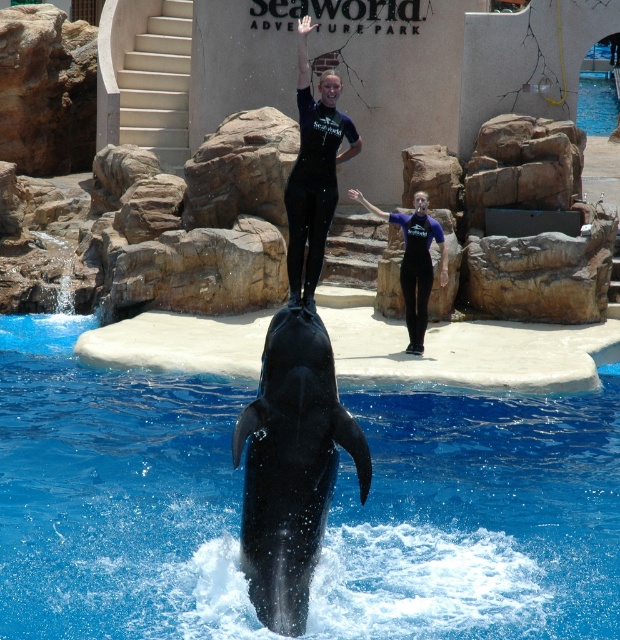
Based on the photo, who is taller, black smooth whale at center or black matte wetsuit at center?

black matte wetsuit at center

Does point (259, 413) lie in front of point (290, 294)?

Yes, point (259, 413) is closer to viewer.

This screenshot has width=620, height=640. In order to click on black smooth whale at center in this screenshot , I will do `click(291, 465)`.

The width and height of the screenshot is (620, 640). I want to click on blue smooth water at center, so click(476, 516).

Which is behind, point (35, 332) or point (303, 40)?

The point (35, 332) is more distant.

Describe the element at coordinates (476, 516) in the screenshot. This screenshot has height=640, width=620. I see `blue smooth water at center` at that location.

The image size is (620, 640). In order to click on blue smooth water at center in this screenshot , I will do `click(476, 516)`.

Which is in front, point (577, 532) or point (399, 220)?

Positioned in front is point (577, 532).

Between point (131, 508) and point (443, 282), which one is positioned behind?

The point (443, 282) is behind.

Find the location of `blue smooth water at center`. blue smooth water at center is located at coordinates (476, 516).

This screenshot has height=640, width=620. Identify the location of blue smooth water at center. (476, 516).